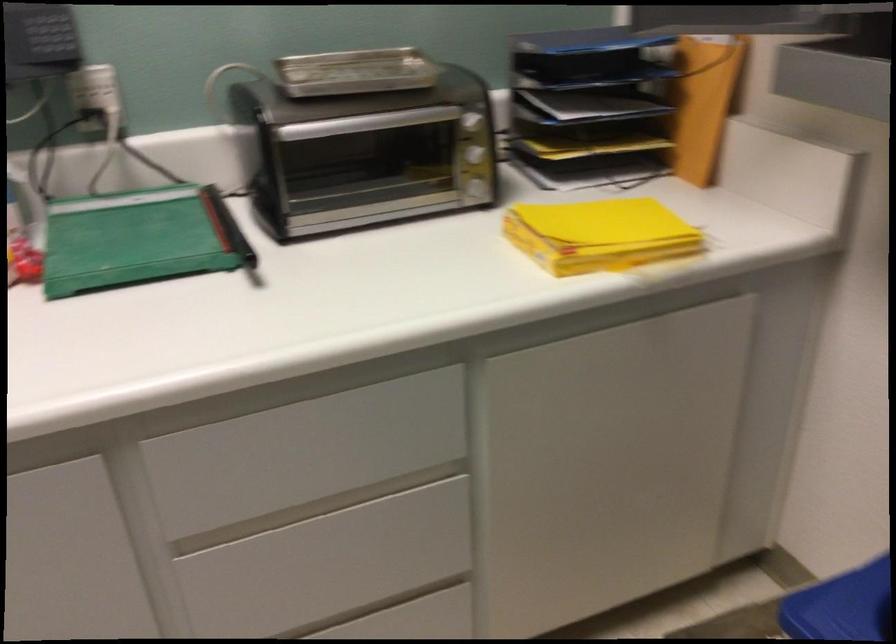
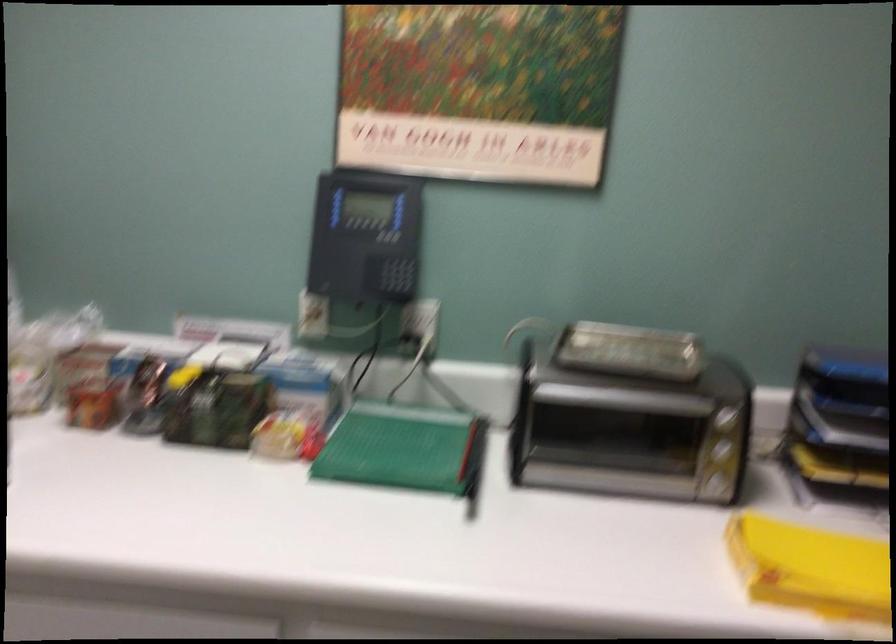
Question: The images are taken continuously from a first-person perspective. In which direction is your viewpoint rotating?

Choices:
 (A) Left
 (B) Right
 (C) Up
 (D) Down

Answer: (A)